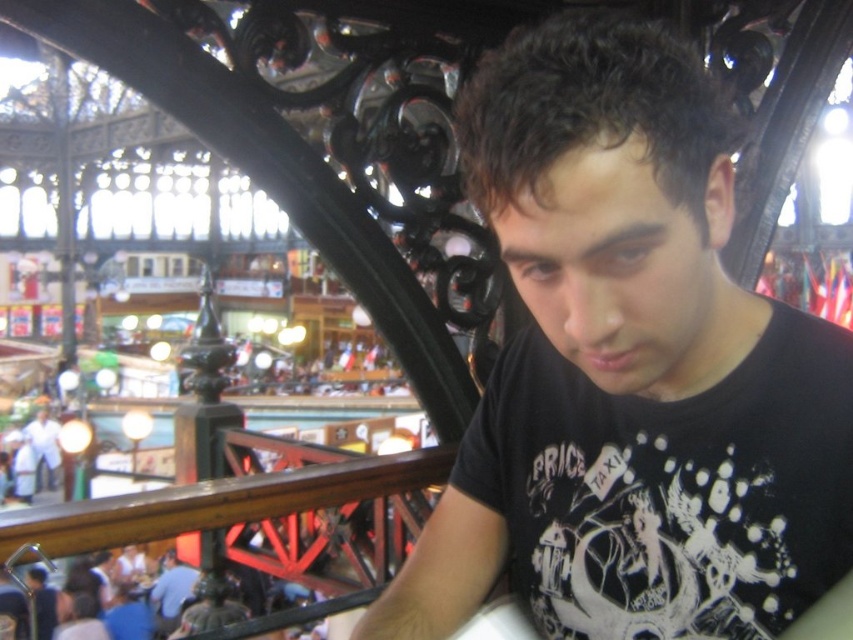
You are organizing a clothing store and need to arrange the blue shirt at lower left and the white cotton shirt at lower left on a shelf. Which shirt should you place on the lower shelf if the lower shelf has limited space and requires items to be smaller in size?

The blue shirt at lower left is smaller than the white cotton shirt at lower left, so you should place the blue shirt at lower left on the lower shelf due to its smaller size.

From the picture: Where is the black matte shirt at center located in the image?

The black matte shirt at center is located at point coordinates of 0.578 on the x axis and 0.739 on the y axis.

You are organizing a clothing store and need to arrange the blue shirt at lower left and the white cotton shirt at lower left on a shelf. Which shirt should you place on the left side of the shelf to match their current arrangement?

The white cotton shirt at lower left should be placed on the left side of the shelf because the blue shirt at lower left is currently positioned on its right side.